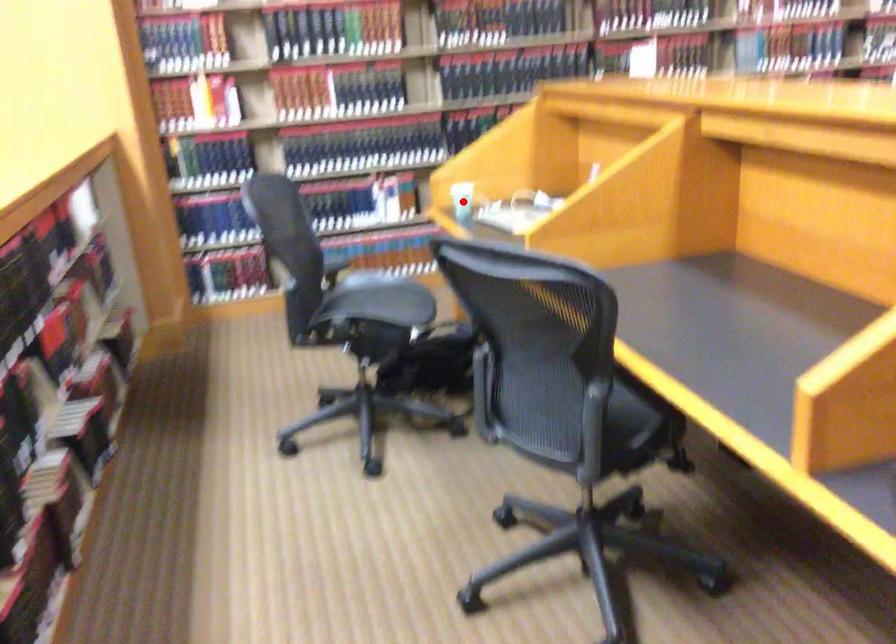
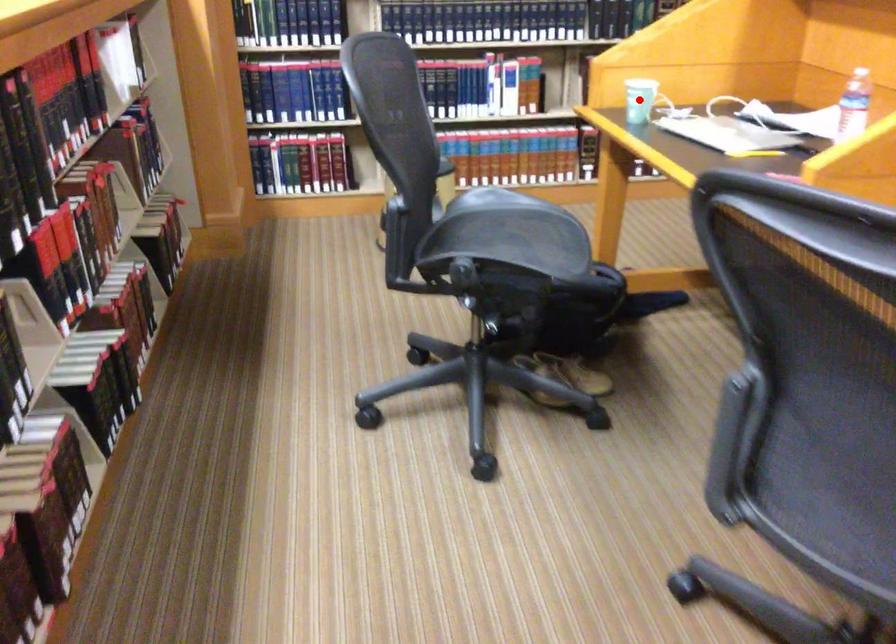
I am providing you with two images of the same scene from different viewpoints. A red point is marked on the first image and another point is marked on the second image. Are the points marked in image1 and image2 representing the same 3D position?

Yes